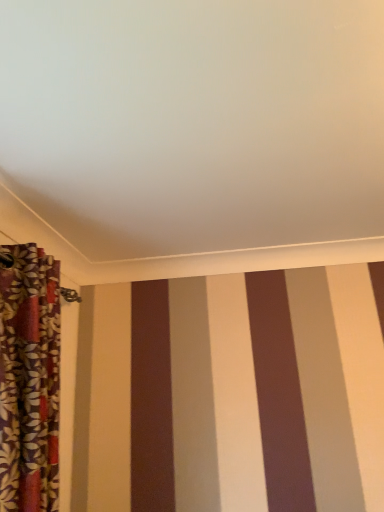
Question: Should I look upward or downward to see floral fabric curtain at left?

Choices:
 (A) down
 (B) up

Answer: (A)